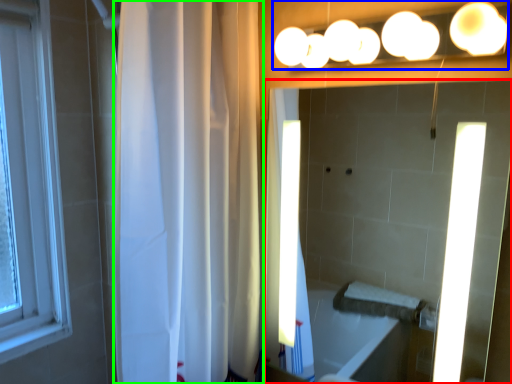
Question: Which is farther away from mirror (highlighted by a red box)? fixture (highlighted by a blue box) or shower curtain (highlighted by a green box)?

Choices:
 (A) fixture
 (B) shower curtain

Answer: (B)